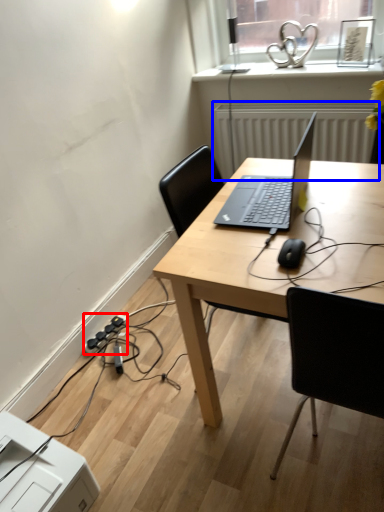
Question: Which of the following is the farthest to the observer, extension cord (highlighted by a red box) or radiator (highlighted by a blue box)?

Choices:
 (A) extension cord
 (B) radiator

Answer: (B)